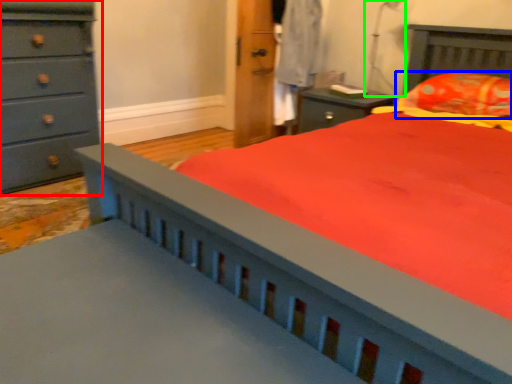
Question: Considering the real-world distances, which object is closest to chest of drawers (highlighted by a red box)? pillow (highlighted by a blue box) or table lamp (highlighted by a green box).

Choices:
 (A) pillow
 (B) table lamp

Answer: (B)